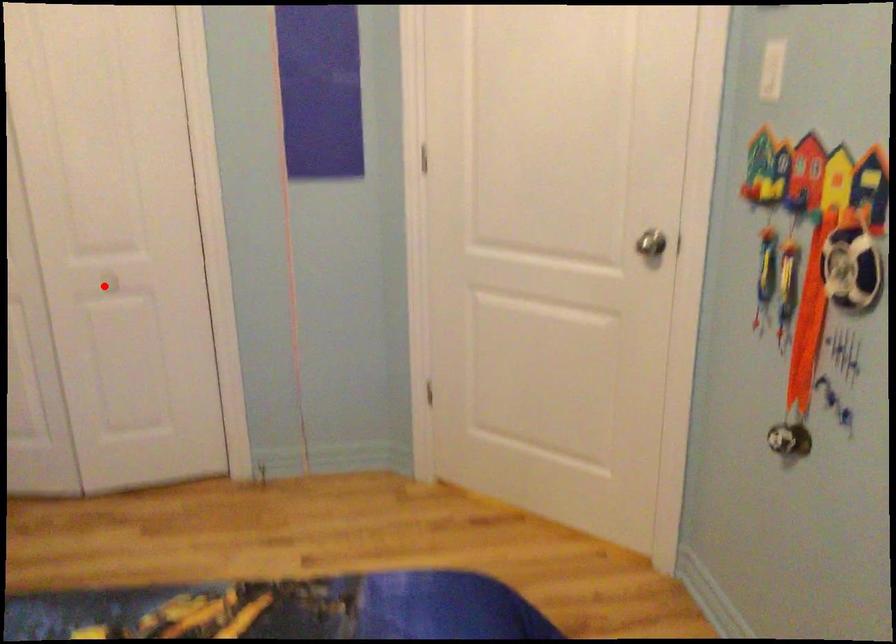
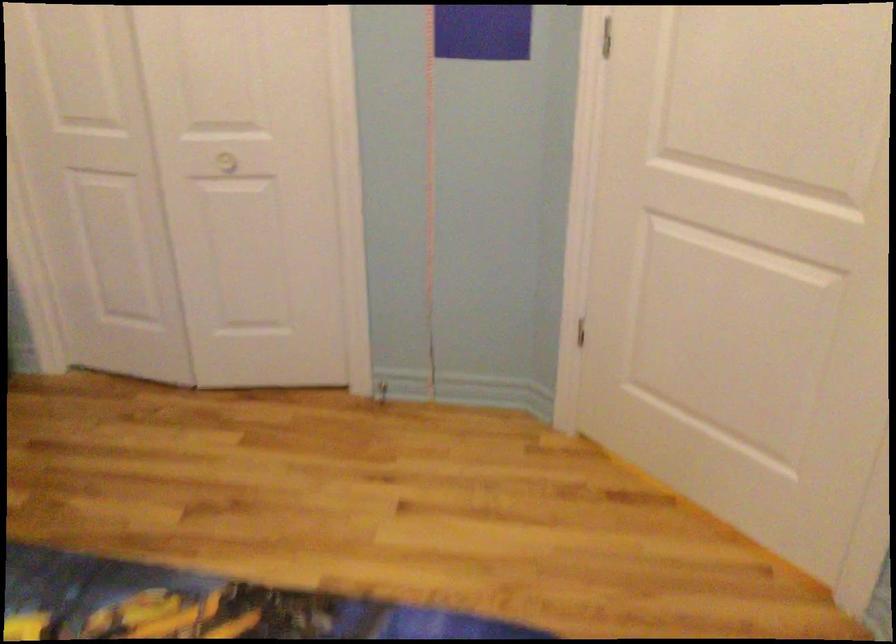
Where in the second image is the point corresponding to the highlighted location from the first image?

(227, 162)